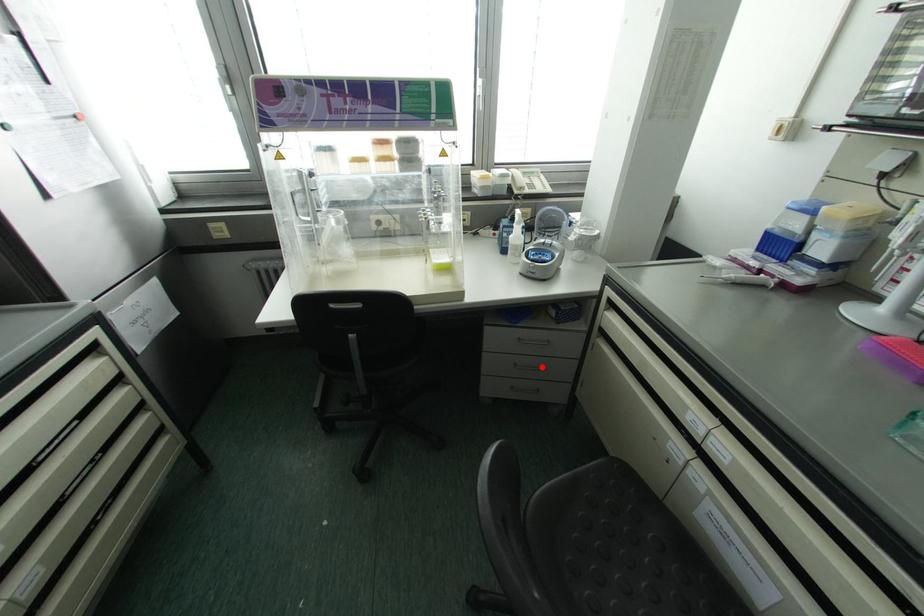
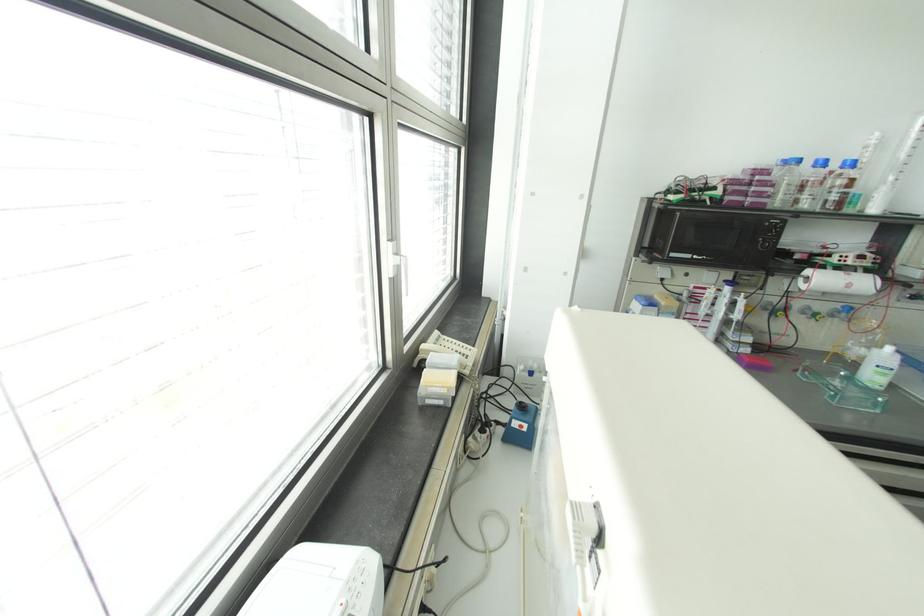
Question: I am providing you with two images of the same scene from different viewpoints. A red point is marked on the first image. At the location where the point appears in image 1, is it still visible in image 2?

Choices:
 (A) Yes
 (B) No

Answer: (B)